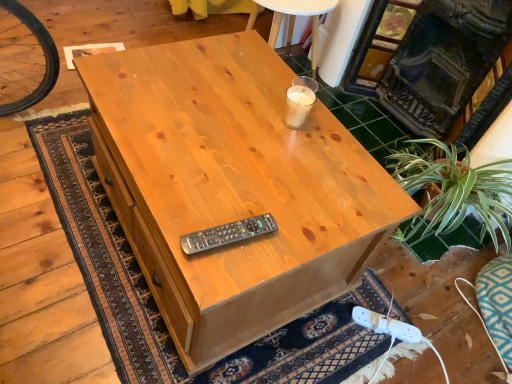
In order to click on free space above natural wood desk at center (from a real-world perspective) in this screenshot , I will do `click(220, 165)`.